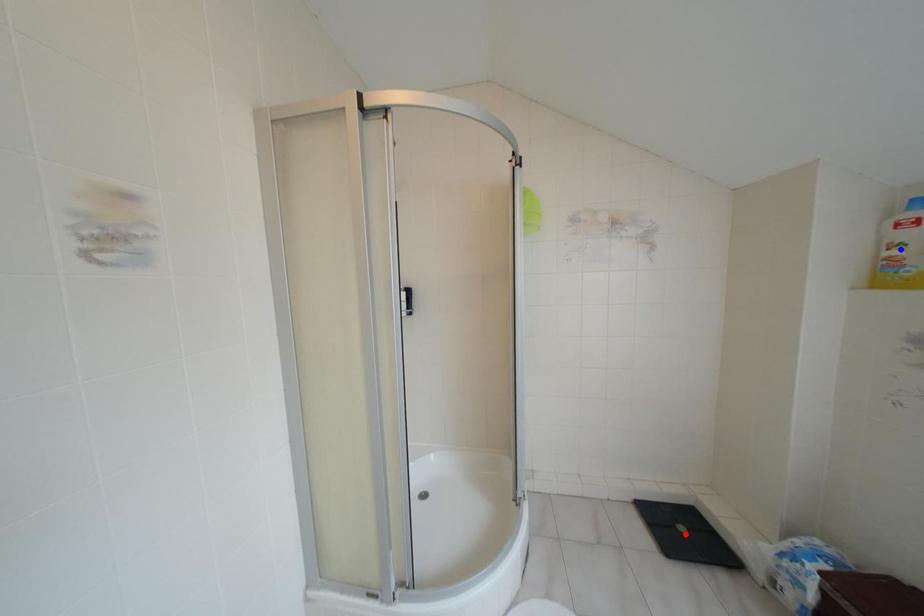
Question: In the image, two points are highlighted. Which point is nearer to the camera? Reply with the corresponding letter.

Choices:
 (A) blue point
 (B) red point

Answer: (A)